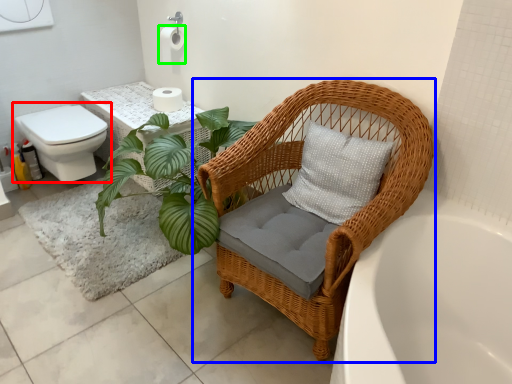
Question: Based on their relative distances, which object is farther from toilet (highlighted by a red box)? Choose from chair (highlighted by a blue box) and toilet paper (highlighted by a green box).

Choices:
 (A) chair
 (B) toilet paper

Answer: (A)